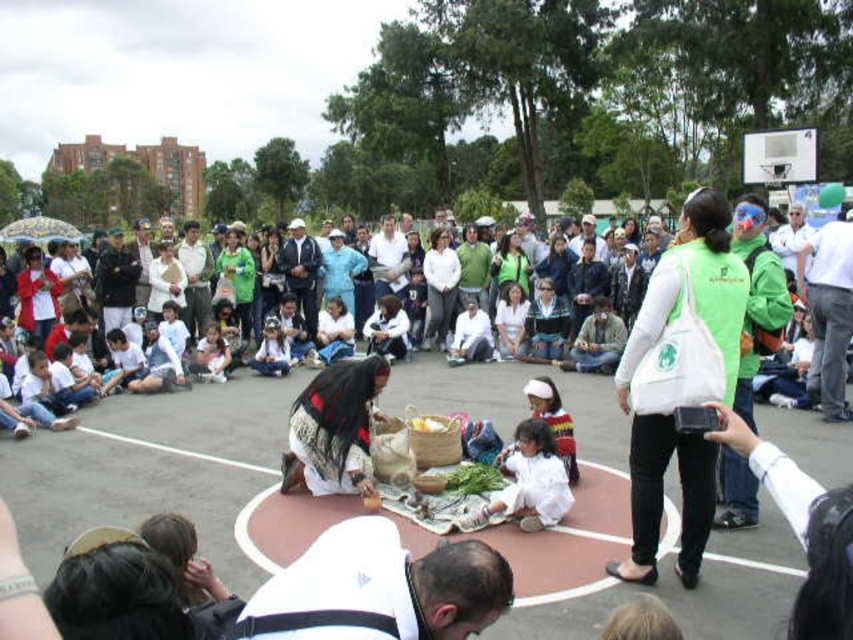
Question: Based on their relative distances, which object is nearer to the green fabric bag at center?

Choices:
 (A) white fabric shirt at lower center
 (B) white fabric blanket at center

Answer: (B)

Question: Can you confirm if green fabric bag at center is wider than patterned fabric dress at center?

Choices:
 (A) no
 (B) yes

Answer: (B)

Question: Is green fabric bag at center positioned before patterned fabric dress at center?

Choices:
 (A) yes
 (B) no

Answer: (A)

Question: Which point appears farthest from the camera in this image?

Choices:
 (A) (602, 486)
 (B) (322, 477)
 (C) (616, 426)

Answer: (C)

Question: Is white woven blanket at center positioned behind green fabric bag at center?

Choices:
 (A) no
 (B) yes

Answer: (A)

Question: Which point is closer to the camera?

Choices:
 (A) (509, 614)
 (B) (296, 540)
 (C) (366, 406)
 (D) (498, 598)

Answer: (D)